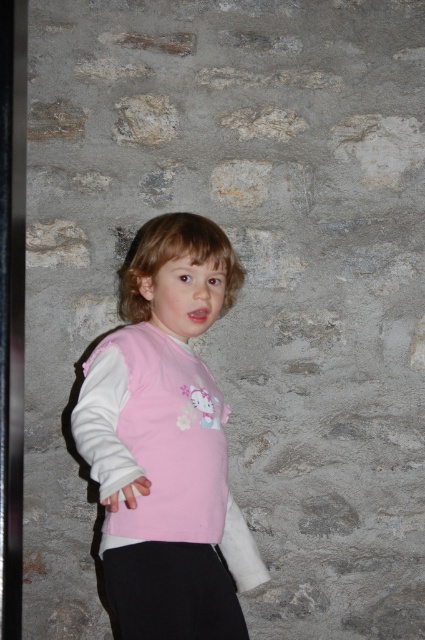
Question: Is pink fabric shirt at center thinner than black cotton pants at lower center?

Choices:
 (A) no
 (B) yes

Answer: (A)

Question: Does pink fabric shirt at center have a greater width compared to black cotton pants at lower center?

Choices:
 (A) no
 (B) yes

Answer: (B)

Question: Among these objects, which one is nearest to the camera?

Choices:
 (A) pink fabric shirt at center
 (B) black cotton pants at lower center

Answer: (A)

Question: Which point is farther to the camera?

Choices:
 (A) (207, 573)
 (B) (164, 465)

Answer: (A)

Question: Does pink fabric shirt at center have a greater width compared to black cotton pants at lower center?

Choices:
 (A) yes
 (B) no

Answer: (A)

Question: Which object is closer to the camera taking this photo?

Choices:
 (A) black cotton pants at lower center
 (B) pink fabric shirt at center

Answer: (B)